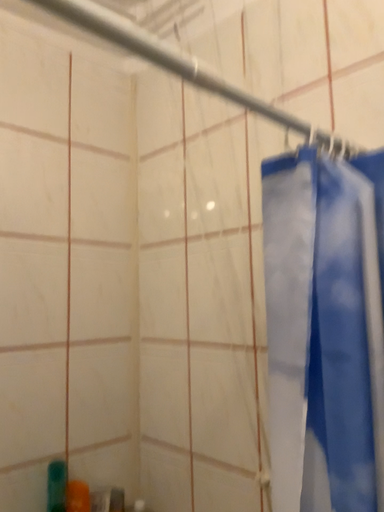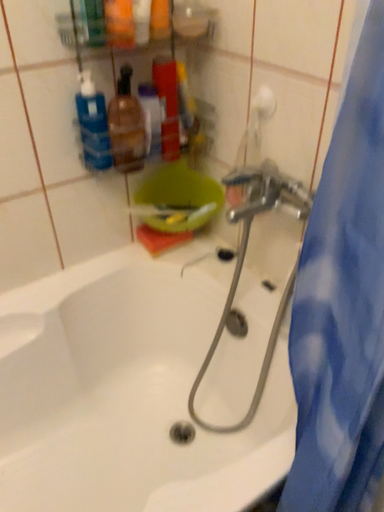
Question: How did the camera likely rotate when shooting the video?

Choices:
 (A) rotated left
 (B) rotated right

Answer: (A)